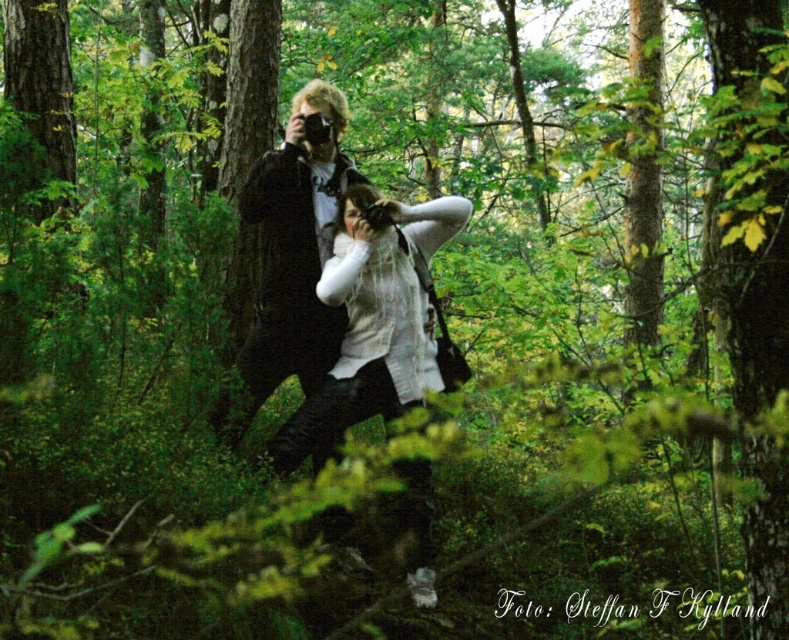
Does white knitted sweater at center have a smaller size compared to matte black jacket at center?

Actually, white knitted sweater at center might be larger than matte black jacket at center.

Is white knitted sweater at center positioned in front of matte black jacket at center?

That is True.

The image size is (789, 640). I want to click on white knitted sweater at center, so click(x=378, y=317).

I want to click on white knitted sweater at center, so click(378, 317).